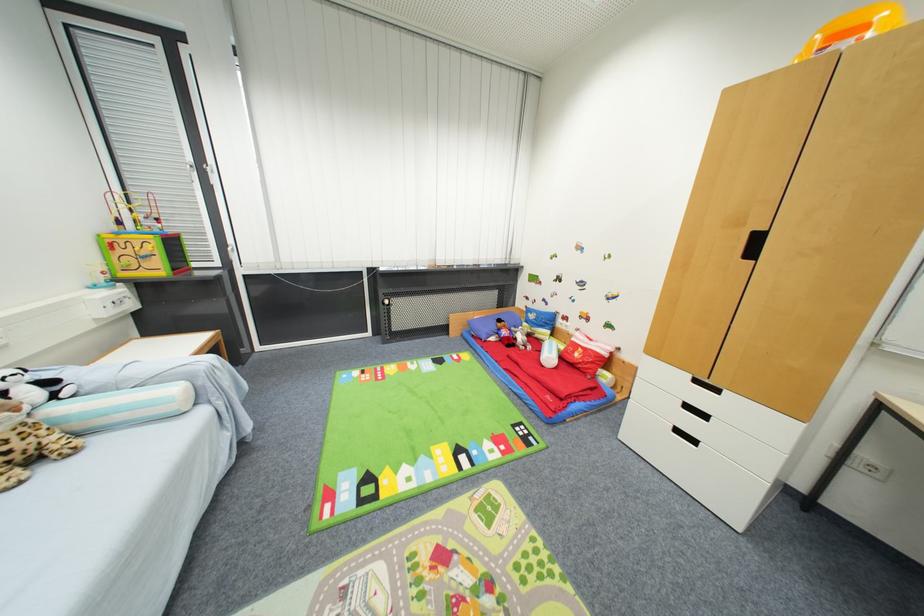
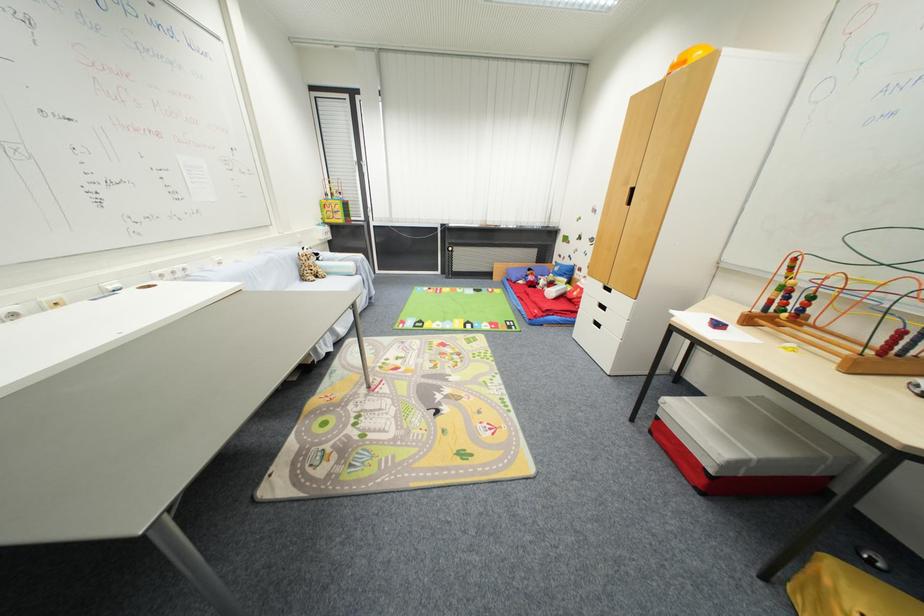
Question: I am providing you with two images of the same scene from different viewpoints. After the viewpoint changes to image2, which objects are now occluded?

Choices:
 (A) stuffed tiger toy
 (B) blue paper bin
 (C) panda stuffed animal
 (D) sofa sitting surface

Answer: (C)